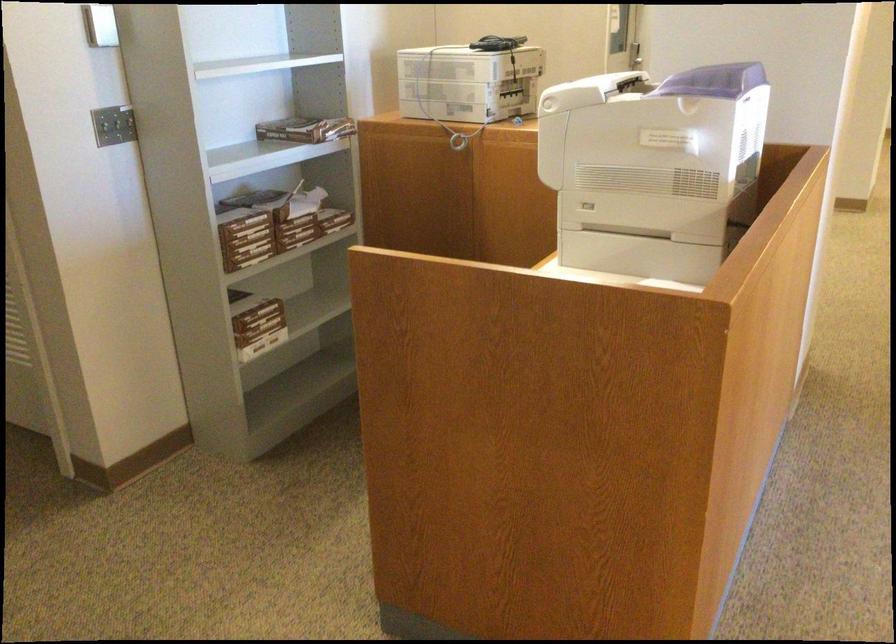
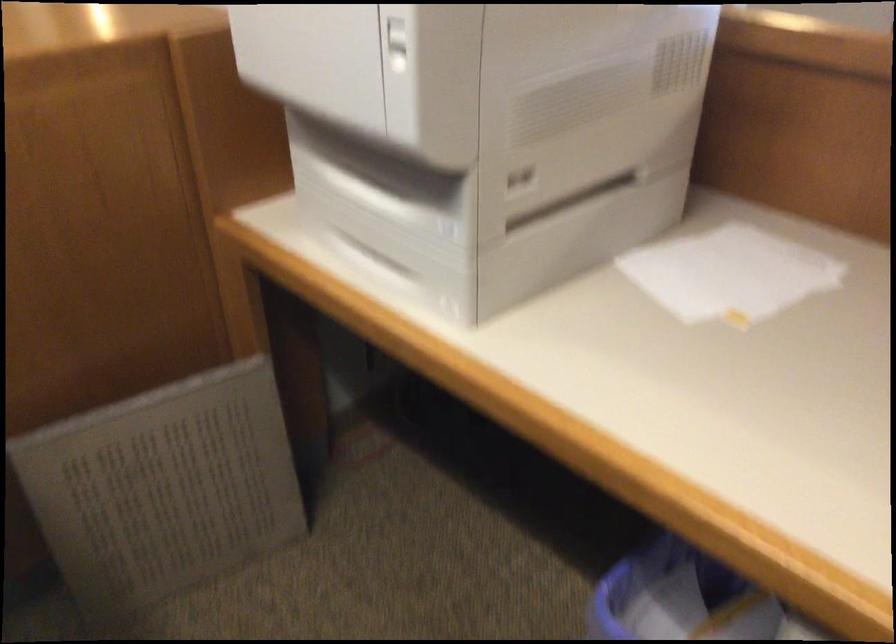
The point at (547,122) is marked in the first image. Where is the corresponding point in the second image?

(397, 44)